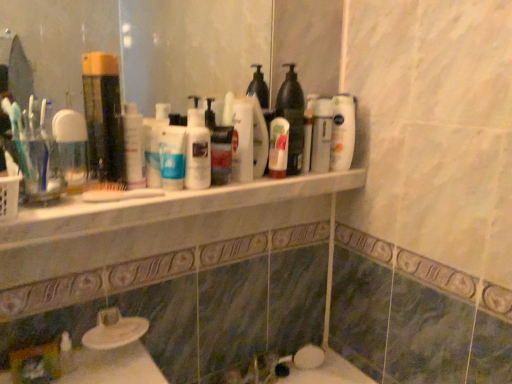
Question: Is translucent plastic bottle at upper center, the 2th cleaning product viewed from the right, spatially inside white glossy lotion at center, the first cleaning product positioned from the left, or outside of it?

Choices:
 (A) outside
 (B) inside

Answer: (A)

Question: Based on their sizes in the image, would you say translucent plastic bottle at upper center, the 2th cleaning product viewed from the right, is bigger or smaller than white glossy lotion at center, the first cleaning product positioned from the left?

Choices:
 (A) big
 (B) small

Answer: (A)

Question: Which object is the farthest from the clear glass mirror at upper center?

Choices:
 (A) white glossy bottle at upper center, marked as the first cleaning product in a right-to-left arrangement
 (B) clear plastic cup at left, the first mouthwash viewed from the left
 (C) translucent plastic mouthwash at left, positioned as the first mouthwash in right-to-left order
 (D) white glossy lotion at center, the first cleaning product positioned from the left
 (E) translucent plastic bottle at upper center, acting as the 4th cleaning product starting from the left

Answer: (B)

Question: Estimate the real-world distances between objects in this image. Which object is closer to the translucent plastic mouthwash at left, positioned as the first mouthwash in right-to-left order?

Choices:
 (A) clear glass mirror at upper center
 (B) white marble counter at center
 (C) white glossy lotion at center, marked as the 1th toiletry in a front-to-back arrangement
 (D) white glossy bottle at center, which appears as the 3th cleaning product when viewed from the left
 (E) translucent plastic bottle at upper center, acting as the 4th cleaning product starting from the left

Answer: (C)